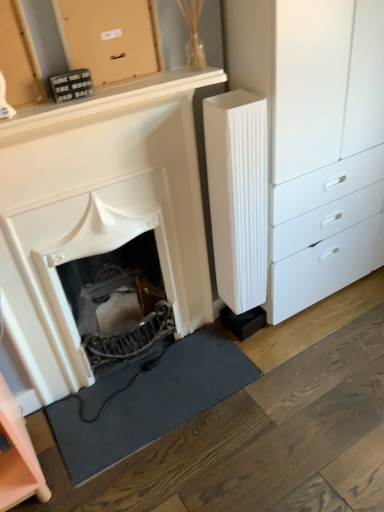
At what (x,y) coordinates should I click in order to perform the action: click on vacant space in front of black rubber doormat at lower left. Please return your answer as a coordinate pair (x, y). The image size is (384, 512). Looking at the image, I should click on (170, 472).